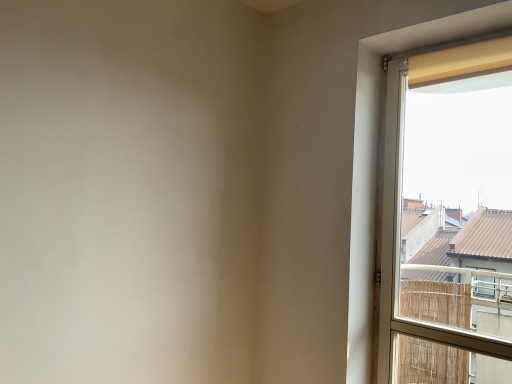
Question: Can you confirm if yellow fabric curtain at upper right is taller than matte yellow curtain at right?

Choices:
 (A) yes
 (B) no

Answer: (B)

Question: Can you confirm if yellow fabric curtain at upper right is thinner than matte yellow curtain at right?

Choices:
 (A) no
 (B) yes

Answer: (B)

Question: Considering the relative sizes of yellow fabric curtain at upper right and matte yellow curtain at right in the image provided, is yellow fabric curtain at upper right shorter than matte yellow curtain at right?

Choices:
 (A) no
 (B) yes

Answer: (B)

Question: Is yellow fabric curtain at upper right smaller than matte yellow curtain at right?

Choices:
 (A) yes
 (B) no

Answer: (A)

Question: Is yellow fabric curtain at upper right looking in the opposite direction of matte yellow curtain at right?

Choices:
 (A) yes
 (B) no

Answer: (A)

Question: Could you tell me if yellow fabric curtain at upper right is facing matte yellow curtain at right?

Choices:
 (A) no
 (B) yes

Answer: (B)

Question: Can you confirm if matte yellow curtain at right is smaller than yellow fabric curtain at upper right?

Choices:
 (A) yes
 (B) no

Answer: (B)

Question: Does matte yellow curtain at right have a greater width compared to yellow fabric curtain at upper right?

Choices:
 (A) yes
 (B) no

Answer: (A)

Question: Is matte yellow curtain at right positioned in front of yellow fabric curtain at upper right?

Choices:
 (A) no
 (B) yes

Answer: (B)

Question: Considering the relative sizes of matte yellow curtain at right and yellow fabric curtain at upper right in the image provided, is matte yellow curtain at right thinner than yellow fabric curtain at upper right?

Choices:
 (A) no
 (B) yes

Answer: (A)

Question: From a real-world perspective, is matte yellow curtain at right located beneath yellow fabric curtain at upper right?

Choices:
 (A) yes
 (B) no

Answer: (A)

Question: Would you say matte yellow curtain at right contains yellow fabric curtain at upper right?

Choices:
 (A) yes
 (B) no

Answer: (A)

Question: From the image's perspective, is matte yellow curtain at right located above or below yellow fabric curtain at upper right?

Choices:
 (A) below
 (B) above

Answer: (A)